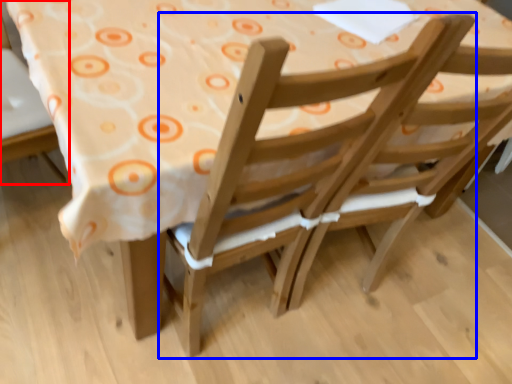
Question: Among these objects, which one is farthest to the camera, chair (highlighted by a red box) or chair (highlighted by a blue box)?

Choices:
 (A) chair
 (B) chair

Answer: (A)